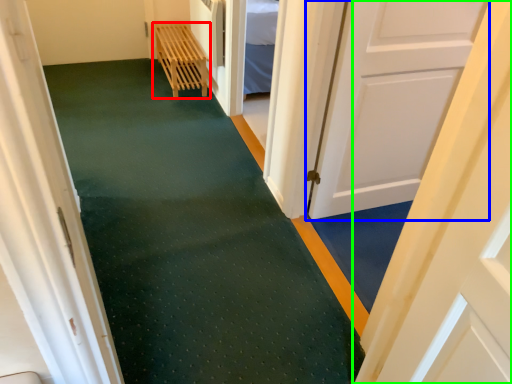
Question: Estimate the real-world distances between objects in this image. Which object is farther from furniture (highlighted by a red box), door (highlighted by a blue box) or door (highlighted by a green box)?

Choices:
 (A) door
 (B) door

Answer: (B)